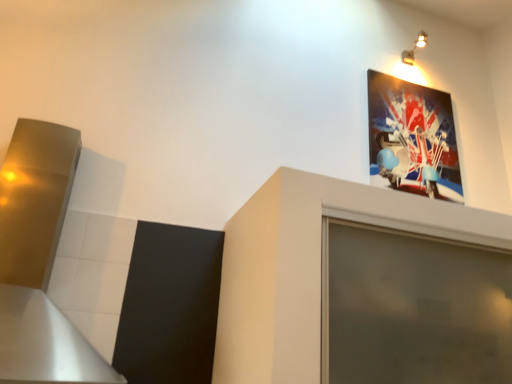
The width and height of the screenshot is (512, 384). Describe the element at coordinates (414, 49) in the screenshot. I see `metallic spotlights at upper right` at that location.

In order to face metallic spotlights at upper right, should I rotate leftwards or rightwards?

Rotate your view right by about 20.964°.

Where is `brushed metal exhaust hood at left`? Image resolution: width=512 pixels, height=384 pixels. brushed metal exhaust hood at left is located at coordinates (39, 261).

Where is `matte plastic picture frame at upper right`? The width and height of the screenshot is (512, 384). matte plastic picture frame at upper right is located at coordinates (413, 136).

Where is `metallic spotlights at upper right`? This screenshot has height=384, width=512. metallic spotlights at upper right is located at coordinates (414, 49).

Who is taller, brushed metal exhaust hood at left or metallic spotlights at upper right?

Standing taller between the two is brushed metal exhaust hood at left.

From the image's perspective, would you say brushed metal exhaust hood at left is shown under metallic spotlights at upper right?

Yes.

Where is `exhaust hood that appears below the metallic spotlights at upper right (from the image's perspective)`? The width and height of the screenshot is (512, 384). exhaust hood that appears below the metallic spotlights at upper right (from the image's perspective) is located at coordinates (39, 261).

Is brushed metal exhaust hood at left positioned beyond the bounds of metallic spotlights at upper right?

Absolutely, brushed metal exhaust hood at left is external to metallic spotlights at upper right.

Is metallic spotlights at upper right situated inside matte plastic picture frame at upper right or outside?

metallic spotlights at upper right cannot be found inside matte plastic picture frame at upper right.

Is metallic spotlights at upper right smaller than matte plastic picture frame at upper right?

Indeed, metallic spotlights at upper right has a smaller size compared to matte plastic picture frame at upper right.

From a real-world perspective, is metallic spotlights at upper right positioned under matte plastic picture frame at upper right based on gravity?

No.

Does point (408, 61) appear closer or farther from the camera than point (386, 92)?

Clearly, point (408, 61) is more distant from the camera than point (386, 92).

Is matte plastic picture frame at upper right far from brushed metal exhaust hood at left?

Absolutely, matte plastic picture frame at upper right is distant from brushed metal exhaust hood at left.

Is point (452, 182) behind point (35, 274)?

Yes, it is behind point (35, 274).

Considering the sizes of objects matte plastic picture frame at upper right and brushed metal exhaust hood at left in the image provided, who is thinner, matte plastic picture frame at upper right or brushed metal exhaust hood at left?

matte plastic picture frame at upper right is thinner.

Looking at this image, is metallic spotlights at upper right wider or thinner than brushed metal exhaust hood at left?

metallic spotlights at upper right is thinner than brushed metal exhaust hood at left.

Is metallic spotlights at upper right to the left of brushed metal exhaust hood at left from the viewer's perspective?

Incorrect, metallic spotlights at upper right is not on the left side of brushed metal exhaust hood at left.

Considering the sizes of objects metallic spotlights at upper right and brushed metal exhaust hood at left in the image provided, who is bigger, metallic spotlights at upper right or brushed metal exhaust hood at left?

brushed metal exhaust hood at left is bigger.

From a real-world perspective, is metallic spotlights at upper right positioned over brushed metal exhaust hood at left based on gravity?

Correct, in the physical world, metallic spotlights at upper right is higher than brushed metal exhaust hood at left.

In the image, is matte plastic picture frame at upper right on the left side or the right side of metallic spotlights at upper right?

In the image, matte plastic picture frame at upper right appears on the left side of metallic spotlights at upper right.

Considering their positions, is matte plastic picture frame at upper right located in front of or behind metallic spotlights at upper right?

In the image, matte plastic picture frame at upper right appears in front of metallic spotlights at upper right.

Is matte plastic picture frame at upper right not near metallic spotlights at upper right?

matte plastic picture frame at upper right is actually quite close to metallic spotlights at upper right.

Identify the location of light fixture lying on the right of matte plastic picture frame at upper right. This screenshot has width=512, height=384. (414, 49).

In terms of height, does brushed metal exhaust hood at left look taller or shorter compared to matte plastic picture frame at upper right?

Clearly, brushed metal exhaust hood at left is taller compared to matte plastic picture frame at upper right.

Does point (102, 380) come behind point (370, 133)?

No, (102, 380) is in front of (370, 133).

Considering the relative sizes of brushed metal exhaust hood at left and matte plastic picture frame at upper right in the image provided, is brushed metal exhaust hood at left wider than matte plastic picture frame at upper right?

Yes, brushed metal exhaust hood at left is wider than matte plastic picture frame at upper right.

Is matte plastic picture frame at upper right a part of brushed metal exhaust hood at left?

No, matte plastic picture frame at upper right is not surrounded by brushed metal exhaust hood at left.

In order to click on exhaust hood in front of the metallic spotlights at upper right in this screenshot , I will do `click(39, 261)`.

Identify the location of picture frame that appears below the metallic spotlights at upper right (from a real-world perspective). This screenshot has height=384, width=512. (413, 136).

Looking at the image, which one is located further to metallic spotlights at upper right, matte plastic picture frame at upper right or brushed metal exhaust hood at left?

brushed metal exhaust hood at left lies further to metallic spotlights at upper right than the other object.

Which object lies nearer to the anchor point matte plastic picture frame at upper right, brushed metal exhaust hood at left or metallic spotlights at upper right?

The object closer to matte plastic picture frame at upper right is metallic spotlights at upper right.

Which object lies further to the anchor point metallic spotlights at upper right, brushed metal exhaust hood at left or matte plastic picture frame at upper right?

brushed metal exhaust hood at left.

Estimate the real-world distances between objects in this image. Which object is closer to matte plastic picture frame at upper right, metallic spotlights at upper right or brushed metal exhaust hood at left?

Among the two, metallic spotlights at upper right is located nearer to matte plastic picture frame at upper right.

Considering their positions, is metallic spotlights at upper right positioned closer to brushed metal exhaust hood at left than matte plastic picture frame at upper right?

matte plastic picture frame at upper right lies closer to brushed metal exhaust hood at left than the other object.

From the image, which object appears to be nearer to brushed metal exhaust hood at left, matte plastic picture frame at upper right or metallic spotlights at upper right?

matte plastic picture frame at upper right is positioned closer to the anchor brushed metal exhaust hood at left.

Where is `picture frame between brushed metal exhaust hood at left and metallic spotlights at upper right`? picture frame between brushed metal exhaust hood at left and metallic spotlights at upper right is located at coordinates (413, 136).